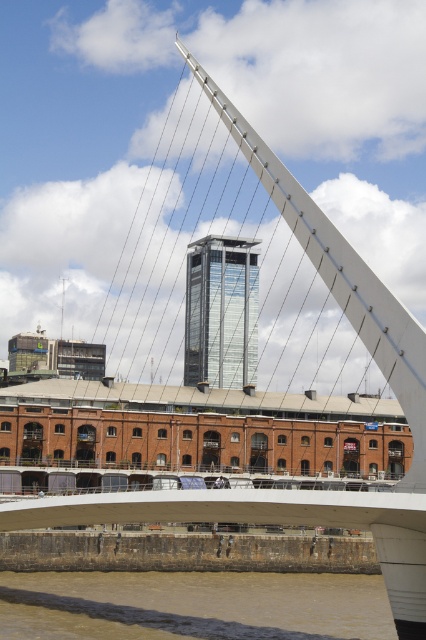
Question: Which object is closer to the camera taking this photo?

Choices:
 (A) brown muddy water at lower center
 (B) glassy metallic skyscraper at center

Answer: (A)

Question: Does brown muddy water at lower center lie behind glassy metallic skyscraper at center?

Choices:
 (A) yes
 (B) no

Answer: (B)

Question: Which of the following is the closest to the observer?

Choices:
 (A) 112,634
 (B) 203,269

Answer: (A)

Question: Can you confirm if brown muddy water at lower center is positioned below glassy metallic skyscraper at center?

Choices:
 (A) yes
 (B) no

Answer: (A)

Question: Which point appears farthest from the camera in this image?

Choices:
 (A) (54, 573)
 (B) (207, 268)

Answer: (B)

Question: Where is brown muddy water at lower center located in relation to glassy metallic skyscraper at center in the image?

Choices:
 (A) below
 (B) above

Answer: (A)